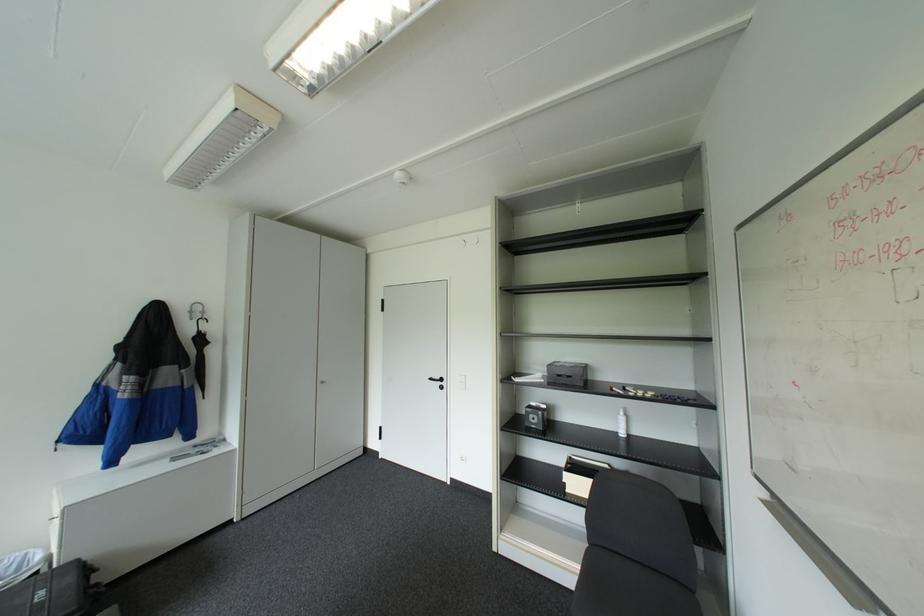
The location [579,475] corresponds to which object?

It refers to a cardboard file holder.